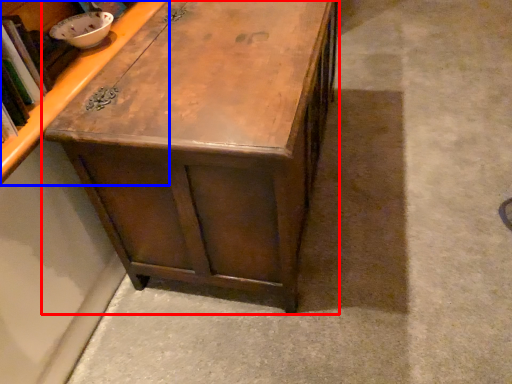
Question: Which point is further to the camera, table (highlighted by a red box) or cabinetry (highlighted by a blue box)?

Choices:
 (A) table
 (B) cabinetry

Answer: (A)